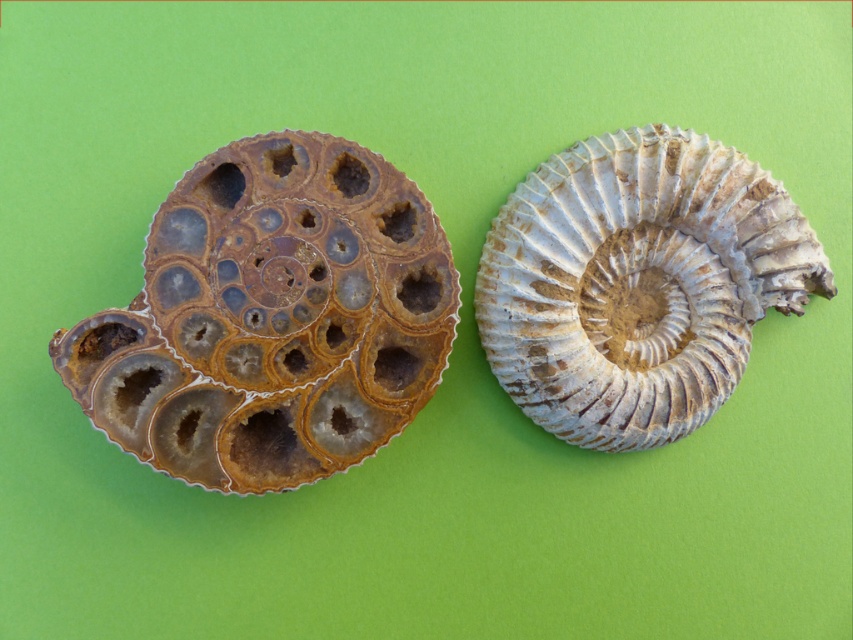
Is point (247, 269) positioned after point (706, 301)?

No, (247, 269) is in front of (706, 301).

Does translucent amber fossil at left have a lesser height compared to white textured fossil at center?

No, translucent amber fossil at left is not shorter than white textured fossil at center.

At what (x,y) coordinates should I click in order to perform the action: click on translucent amber fossil at left. Please return your answer as a coordinate pair (x, y). Image resolution: width=853 pixels, height=640 pixels. Looking at the image, I should click on (271, 317).